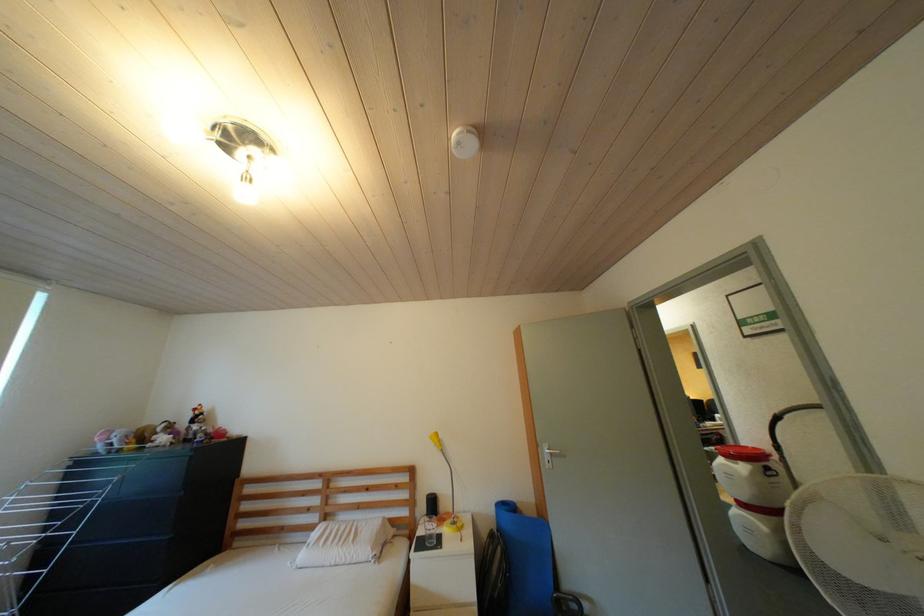
Where would you press the white smoke detector? Please return your answer as a coordinate pair (x, y).

(465, 142)